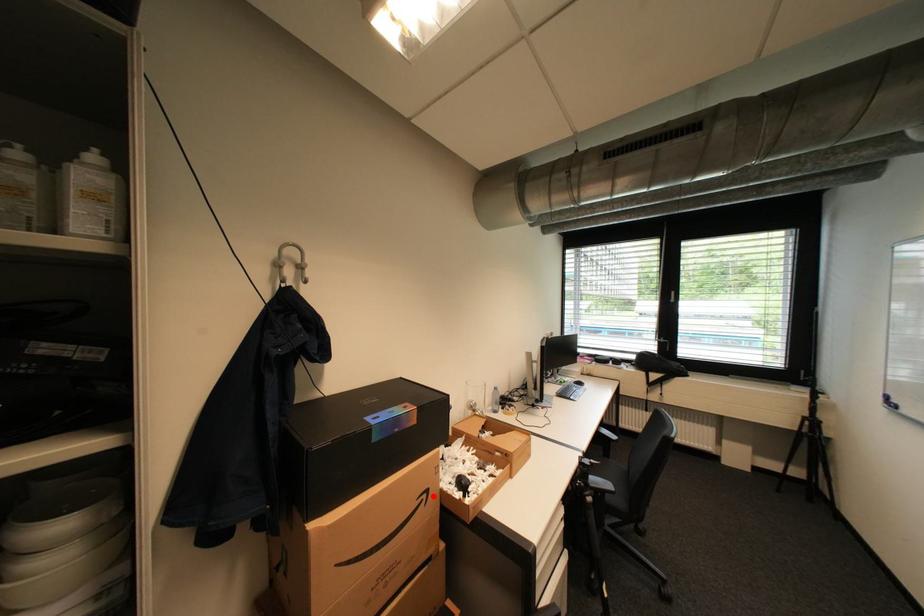
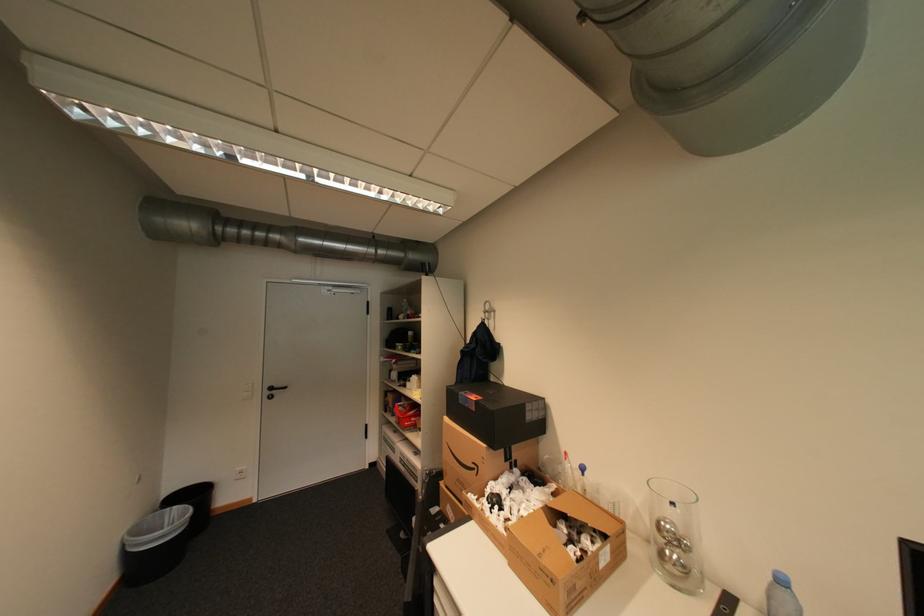
Find the pixel in the second image that matches the highlighted location in the first image.

(484, 468)